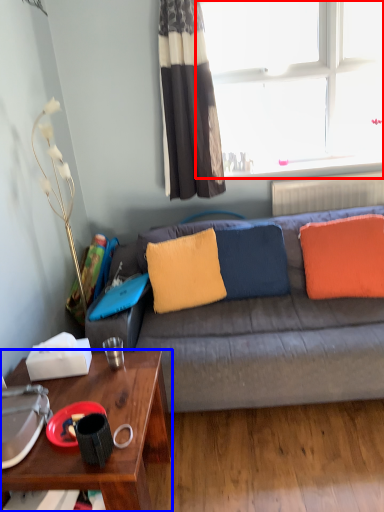
Question: Which point is closer to the camera, window (highlighted by a red box) or desk (highlighted by a blue box)?

Choices:
 (A) window
 (B) desk

Answer: (B)